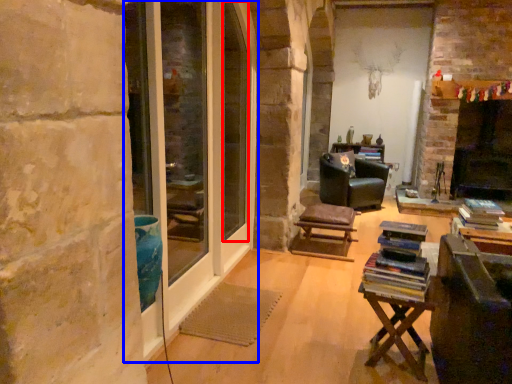
Question: Which point is further to the camera, window screen (highlighted by a red box) or screen door (highlighted by a blue box)?

Choices:
 (A) window screen
 (B) screen door

Answer: (A)